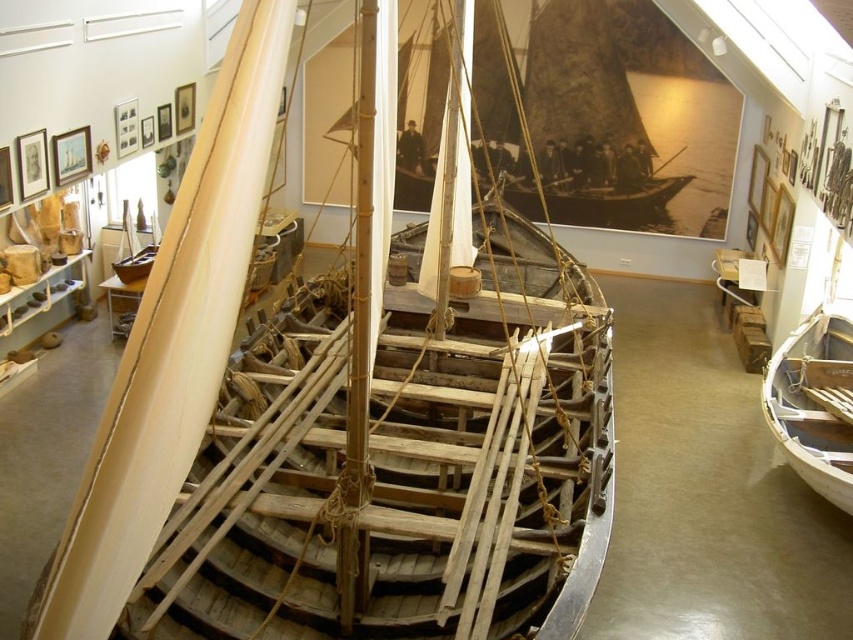
Based on the photo, you are a visitor in the museum and want to know which boat is taller between the wooden sailboat at upper center and the white wood boat at lower right. Can you determine this based on their positions?

The wooden sailboat at upper center is shorter than the white wood boat at lower right, so the white wood boat at lower right is taller.